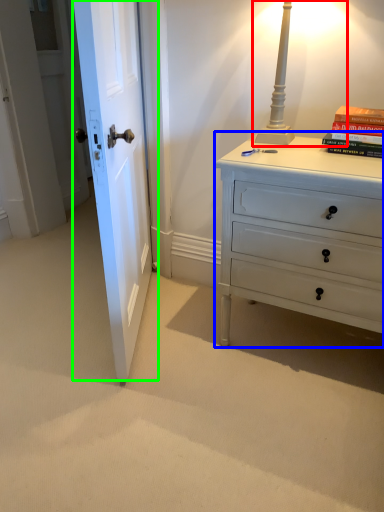
Question: Based on their relative distances, which object is farther from table lamp (highlighted by a red box)? Choose from chest of drawers (highlighted by a blue box) and door (highlighted by a green box).

Choices:
 (A) chest of drawers
 (B) door

Answer: (B)